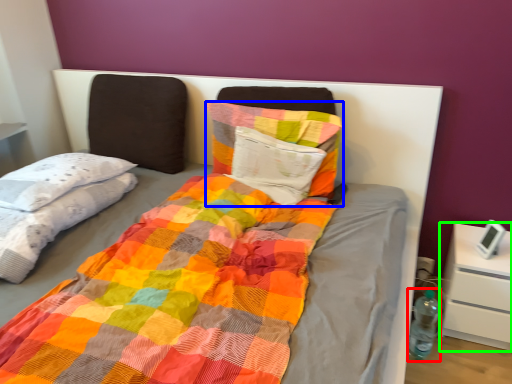
Question: Which is nearer to the bottle (highlighted by a red box)? pillow (highlighted by a blue box) or nightstand (highlighted by a green box).

Choices:
 (A) pillow
 (B) nightstand

Answer: (B)